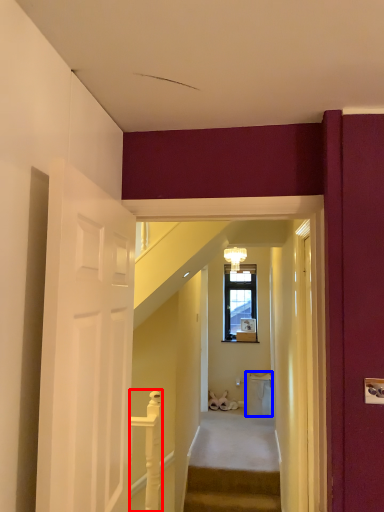
Question: Which object is closer to the camera taking this photo, balustrade (highlighted by a red box) or trash bin/can (highlighted by a blue box)?

Choices:
 (A) balustrade
 (B) trash bin/can

Answer: (A)